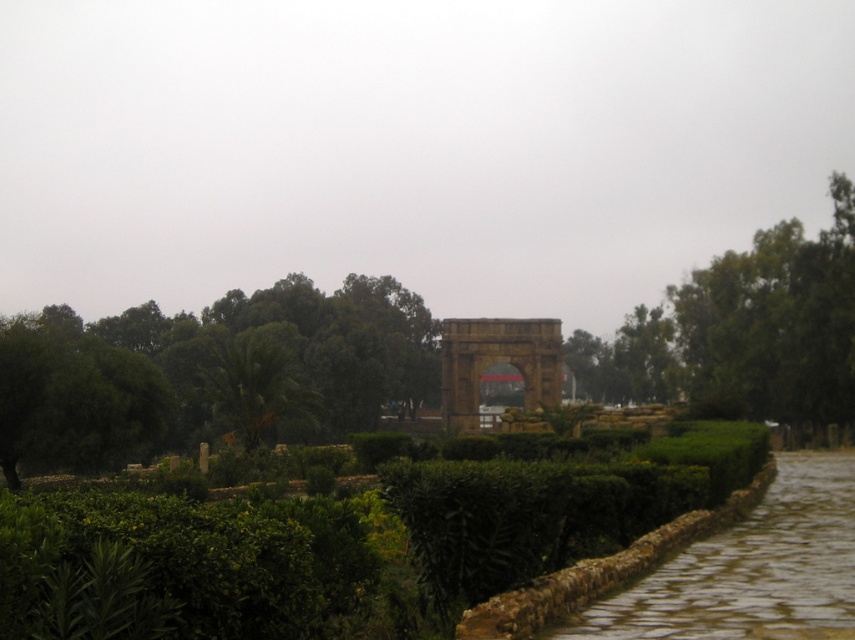
Question: Does green leafy tree at left come in front of paved stone path at center?

Choices:
 (A) no
 (B) yes

Answer: (A)

Question: Which object is closer to the camera taking this photo?

Choices:
 (A) green leafy tree at center
 (B) paved stone path at center
 (C) green leafy hedge at center

Answer: (C)

Question: Which object is the closest to the green leafy tree at center?

Choices:
 (A) green leafy hedge at center
 (B) green leafy tree at upper right

Answer: (A)

Question: Among these points, which one is farthest from the camera?

Choices:
 (A) (802, 547)
 (B) (671, 378)
 (C) (219, 412)
 (D) (305, 627)

Answer: (B)

Question: Does green leafy tree at upper right have a larger size compared to green leafy tree at center?

Choices:
 (A) no
 (B) yes

Answer: (B)

Question: Is green leafy tree at left to the left of paved stone path at center from the viewer's perspective?

Choices:
 (A) yes
 (B) no

Answer: (A)